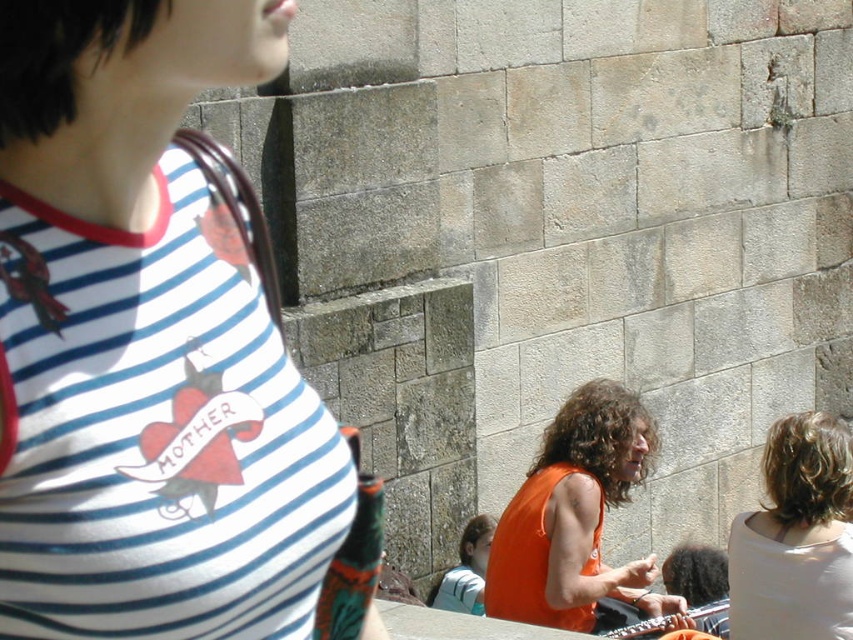
Is white matte hair at upper right wider than light blue fabric shirt at lower center?

Correct, the width of white matte hair at upper right exceeds that of light blue fabric shirt at lower center.

Looking at this image, is white matte hair at upper right to the left of light blue fabric shirt at lower center from the viewer's perspective?

No, white matte hair at upper right is not to the left of light blue fabric shirt at lower center.

Identify the location of white matte hair at upper right. (796, 538).

Locate an element on the screen. white matte hair at upper right is located at coordinates (796, 538).

Describe the element at coordinates (575, 516) in the screenshot. I see `orange sleeveless top at center` at that location.

Which is below, orange sleeveless top at center or white matte hair at upper right?

orange sleeveless top at center

This screenshot has width=853, height=640. I want to click on orange sleeveless top at center, so click(575, 516).

In the scene shown: Which is more to the left, orange sleeveless top at center or light blue fabric shirt at lower center?

light blue fabric shirt at lower center

Which of these two, orange sleeveless top at center or light blue fabric shirt at lower center, stands taller?

orange sleeveless top at center

Is point (524, 490) closer to viewer compared to point (463, 593)?

Yes, point (524, 490) is in front of point (463, 593).

At what (x,y) coordinates should I click in order to perform the action: click on orange sleeveless top at center. Please return your answer as a coordinate pair (x, y). The height and width of the screenshot is (640, 853). Looking at the image, I should click on (575, 516).